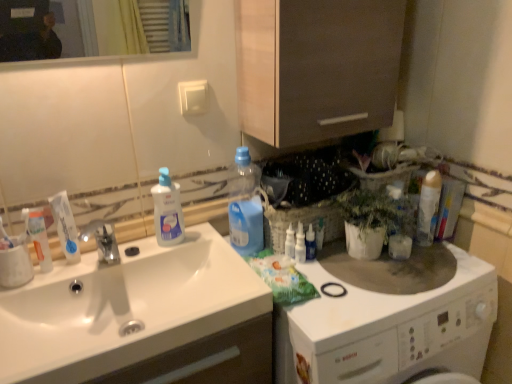
Find the location of a particular element. The height and width of the screenshot is (384, 512). vacant space in front of translucent plastic bottles at upper right, acting as the 1th toiletry starting from the back is located at coordinates (342, 279).